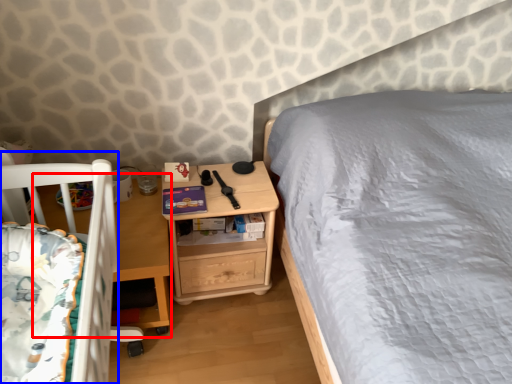
Question: Which object appears farthest to the camera in this image, table (highlighted by a red box) or infant bed (highlighted by a blue box)?

Choices:
 (A) table
 (B) infant bed

Answer: (A)